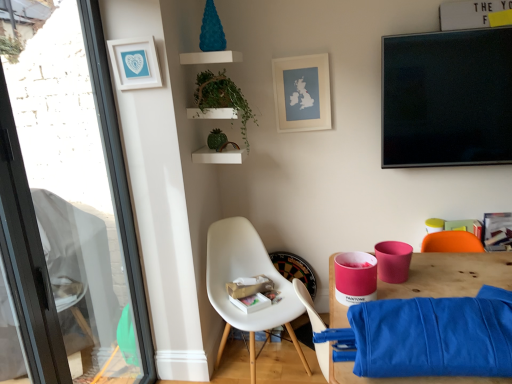
Question: Does green matte plant at upper center contain matte white picture frame at upper center, arranged as the 1th picture frame when viewed from the right?

Choices:
 (A) yes
 (B) no

Answer: (B)

Question: From the image's perspective, is green matte plant at upper center below matte white picture frame at upper center, acting as the second picture frame starting from the left?

Choices:
 (A) yes
 (B) no

Answer: (A)

Question: Can you confirm if green matte plant at upper center is smaller than matte white picture frame at upper center, positioned as the 1th picture frame in back-to-front order?

Choices:
 (A) no
 (B) yes

Answer: (A)

Question: From the image's perspective, is green matte plant at upper center over matte white picture frame at upper center, arranged as the 1th picture frame when viewed from the right?

Choices:
 (A) yes
 (B) no

Answer: (B)

Question: Does green matte plant at upper center lie behind matte white picture frame at upper center, acting as the second picture frame starting from the left?

Choices:
 (A) yes
 (B) no

Answer: (B)

Question: From a real-world perspective, relative to transparent glass window at left, is matte white picture frame at upper center, positioned as the 1th picture frame in back-to-front order, vertically above or below?

Choices:
 (A) below
 (B) above

Answer: (B)

Question: In terms of size, does matte white picture frame at upper center, positioned as the 1th picture frame in back-to-front order, appear bigger or smaller than transparent glass window at left?

Choices:
 (A) small
 (B) big

Answer: (A)

Question: In the image, is matte white picture frame at upper center, positioned as the 1th picture frame in back-to-front order, positioned in front of or behind transparent glass window at left?

Choices:
 (A) behind
 (B) front

Answer: (A)

Question: From the image's perspective, is matte white picture frame at upper center, the 2th picture frame from the front, located above or below transparent glass window at left?

Choices:
 (A) above
 (B) below

Answer: (A)

Question: From the image's perspective, is transparent glass window at left above or below white matte picture frame at upper left, the first picture frame viewed from the front?

Choices:
 (A) above
 (B) below

Answer: (B)

Question: Considering the positions of point (32, 236) and point (137, 72), is point (32, 236) closer or farther from the camera than point (137, 72)?

Choices:
 (A) closer
 (B) farther

Answer: (A)

Question: Based on their sizes in the image, would you say transparent glass window at left is bigger or smaller than white matte picture frame at upper left, which is the 1th picture frame from left to right?

Choices:
 (A) small
 (B) big

Answer: (B)

Question: Visually, is transparent glass window at left positioned to the left or to the right of white matte picture frame at upper left, the second picture frame in the right-to-left sequence?

Choices:
 (A) right
 (B) left

Answer: (B)

Question: Is white matte picture frame at upper left, the first picture frame viewed from the front, inside the boundaries of white plastic chair at lower center, or outside?

Choices:
 (A) inside
 (B) outside

Answer: (B)

Question: Based on their sizes in the image, would you say white matte picture frame at upper left, the second picture frame in the right-to-left sequence, is bigger or smaller than white plastic chair at lower center?

Choices:
 (A) small
 (B) big

Answer: (A)